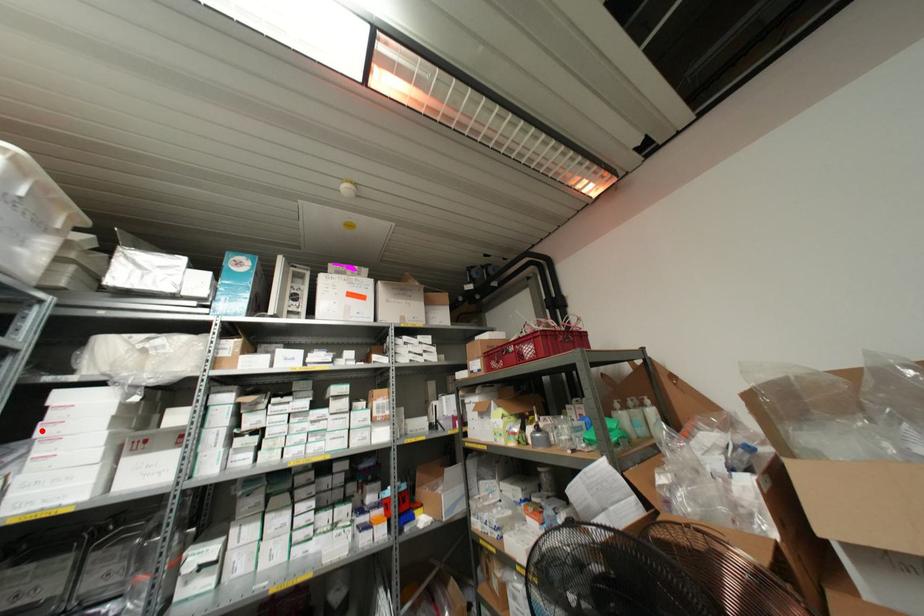
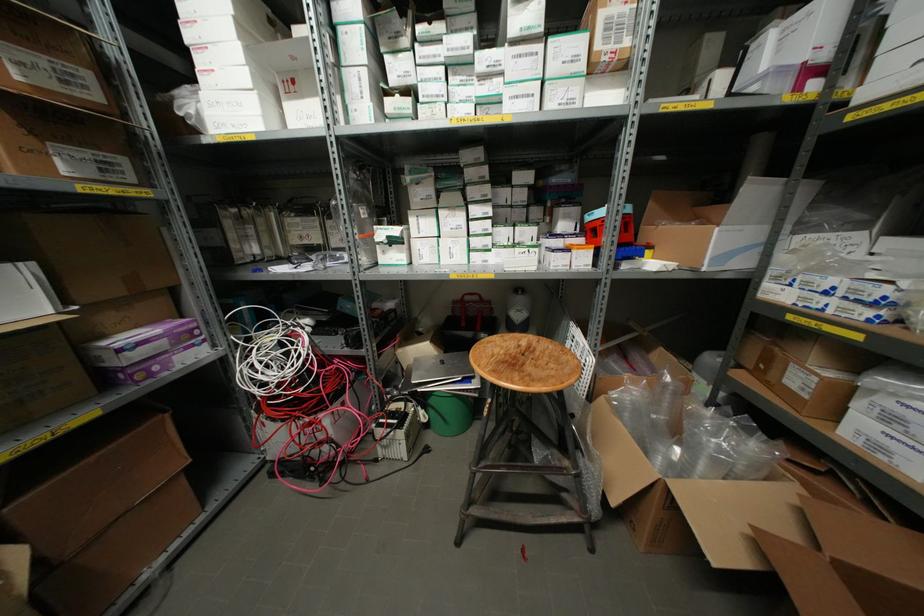
In the second image, find the point that corresponds to the highlighted location in the first image.

(188, 36)